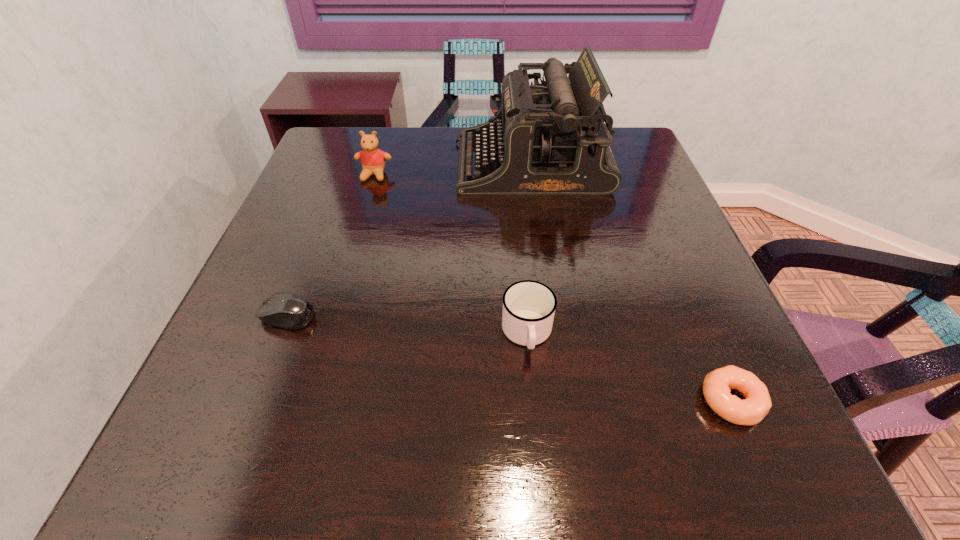
Where is `the tallest object`? The width and height of the screenshot is (960, 540). the tallest object is located at coordinates (550, 138).

Locate an element on the screen. This screenshot has height=540, width=960. teddy bear is located at coordinates (373, 159).

The height and width of the screenshot is (540, 960). Identify the location of mug. (529, 306).

Image resolution: width=960 pixels, height=540 pixels. I want to click on mouse, so click(x=282, y=309).

Identify the location of the nearest object. The image size is (960, 540). (716, 387).

At what (x,y) coordinates should I click in order to perform the action: click on the rightmost object. Please return your answer as a coordinate pair (x, y). This screenshot has height=540, width=960. Looking at the image, I should click on (716, 387).

You are a GUI agent. You are given a task and a screenshot of the screen. Output one action in this format:
    pyautogui.click(x=<x>, y=<y>)
    Task: Click on the vacant space situated on the keyboard of the tallest object
    This screenshot has height=540, width=960.
    Given the screenshot: What is the action you would take?
    pyautogui.click(x=323, y=164)

Identify the location of vacant space located 0.300m on the keyboard of the tallest object. The image size is (960, 540). [345, 164].

Where is `vacant space located on the keyboard of the tallest object`? vacant space located on the keyboard of the tallest object is located at coordinates (311, 164).

Image resolution: width=960 pixels, height=540 pixels. What are the coordinates of `vacant area situated on the front-facing side of the teddy bear` in the screenshot? It's located at (349, 258).